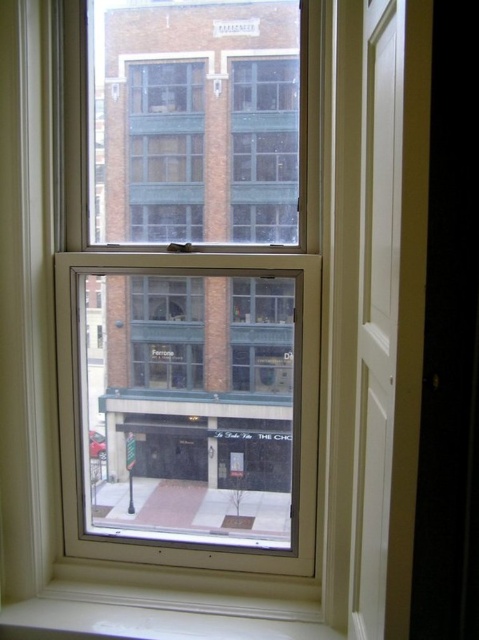
Looking at this image, is clear glass window at center below white smooth window sill at lower center?

No.

Who is more forward, (216, 406) or (166, 636)?

Point (166, 636) is in front.

Which is in front, point (163, 260) or point (265, 620)?

Point (265, 620) is more forward.

At what (x,y) coordinates should I click in order to perform the action: click on clear glass window at center. Please return your answer as a coordinate pair (x, y). This screenshot has width=479, height=640. Looking at the image, I should click on (191, 288).